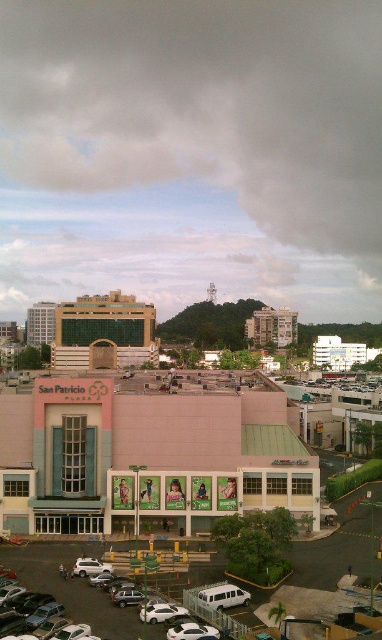
You are a city planner evaluating the San Patricio Plaza area. You need to determine if the pink matte building at center can be expanded northward without encroaching on the green glass building at upper left. Based on their sizes, what is your assessment?

The pink matte building at center is smaller than the green glass building at upper left. Since the pink building is smaller, it might have more space available for expansion northward without immediately conflicting with the larger green glass building at upper left, provided other zoning regulations are considered.

You are standing at the point marked by the coordinates point (147, 456) in the image. What is the closest object to you in the scene?

The closest object to you at point (147, 456) is the pink matte building at center, as the coordinates indicate that location.